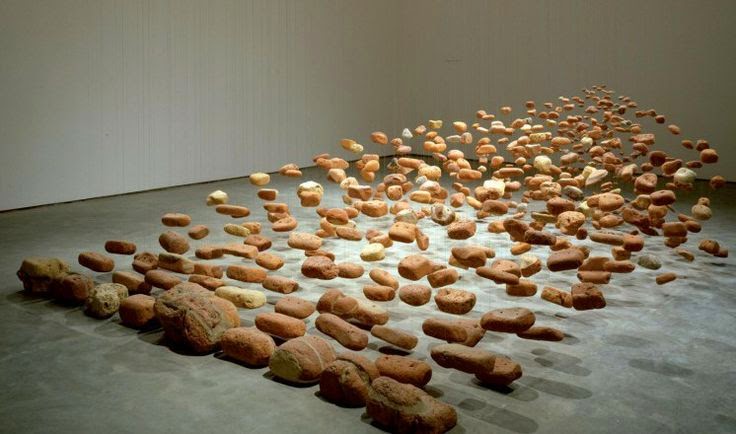
What are the coordinates of `floor` in the screenshot? It's located at (132, 215).